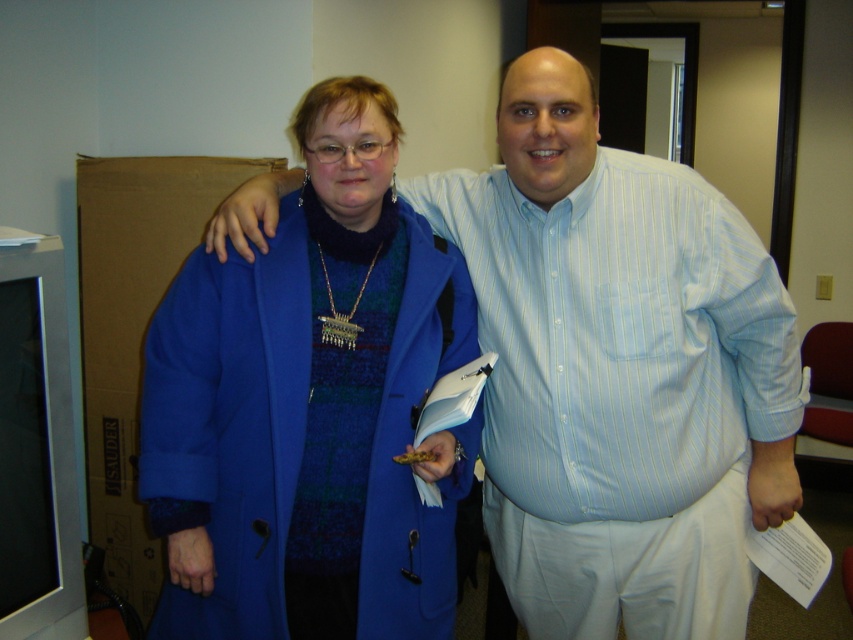
You are trying to determine which clothing item takes up more space in the image. Which one is bigger between the light blue striped shirt at center and the blue wool coat at center?

The light blue striped shirt at center is larger in size than the blue wool coat at center.

What are the coordinates of the light blue striped shirt at center?

The light blue striped shirt at center is located at coordinates point (614, 364).